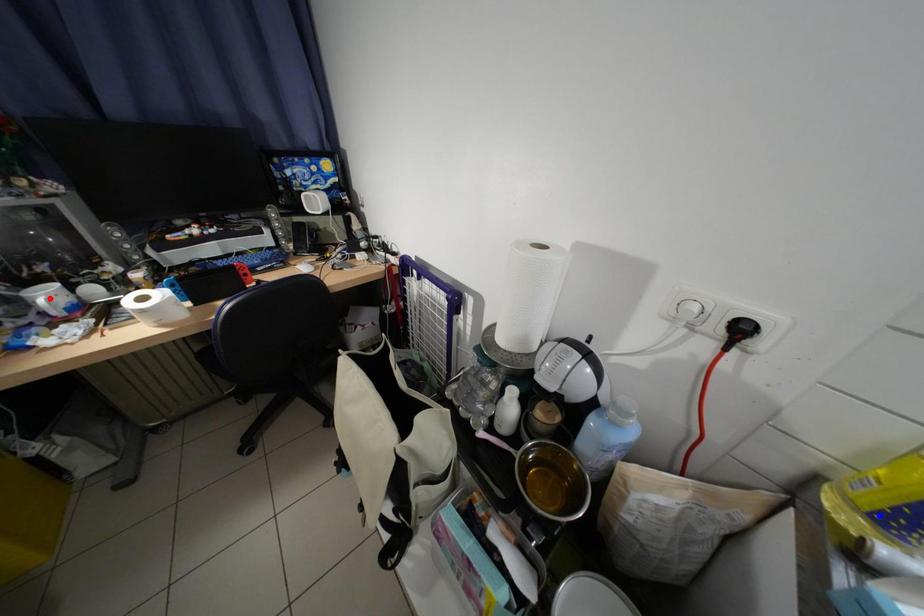
Question: In the image, two points are highlighted. Which point is nearer to the camera? Reply with the corresponding letter.

Choices:
 (A) blue point
 (B) red point

Answer: (A)